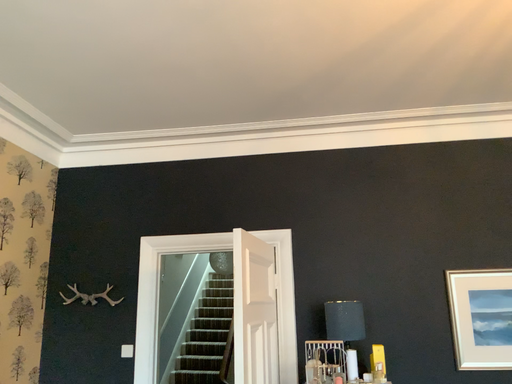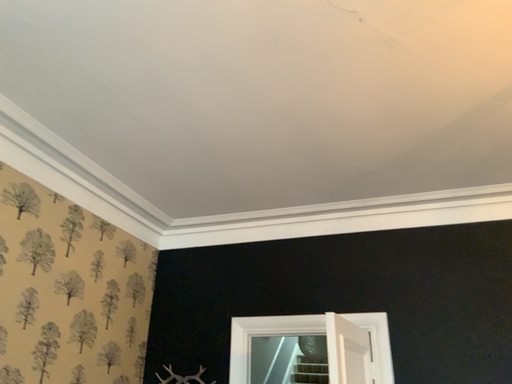
Question: Which way did the camera rotate in the video?

Choices:
 (A) rotated left
 (B) rotated right

Answer: (A)